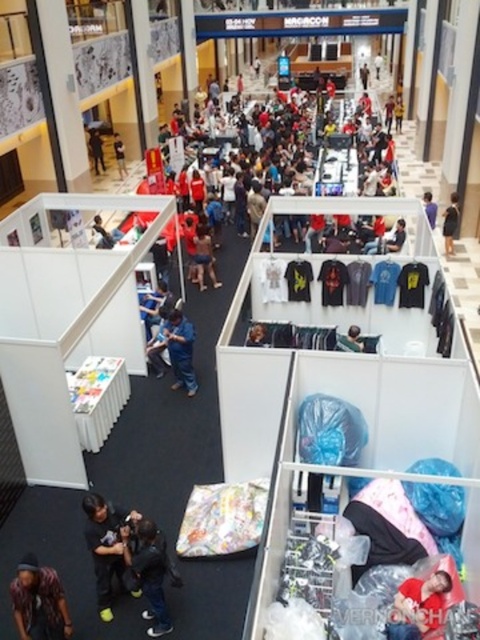
Is multicolored hair at lower left behind matte blue shirt at center?

No, multicolored hair at lower left is in front of matte blue shirt at center.

Does point (21, 588) come farther from viewer compared to point (116, 157)?

No.

You are a GUI agent. You are given a task and a screenshot of the screen. Output one action in this format:
    pyautogui.click(x=<x>, y=<y>)
    Task: Click on the multicolored hair at lower left
    The height and width of the screenshot is (640, 480).
    Given the screenshot: What is the action you would take?
    coord(38,602)

Is point (186, 387) positioned in front of point (457, 202)?

Yes.

Image resolution: width=480 pixels, height=640 pixels. Find the location of `blue jeans at center`. blue jeans at center is located at coordinates coord(180,349).

Who is more forward, (178, 330) or (455, 218)?

Point (178, 330)

You are a GUI agent. You are given a task and a screenshot of the screen. Output one action in this format:
    pyautogui.click(x=<x>, y=<y>)
    Task: Click on the blue jeans at center
    Image resolution: width=480 pixels, height=640 pixels.
    Given the screenshot: What is the action you would take?
    pyautogui.click(x=180, y=349)

Between point (453, 237) and point (120, 161), which one is positioned in front?

Point (453, 237) is in front.

Which of these two, black fabric shirt at center or matte blue shirt at center, stands shorter?

Standing shorter between the two is matte blue shirt at center.

The height and width of the screenshot is (640, 480). What do you see at coordinates (450, 224) in the screenshot?
I see `black fabric shirt at center` at bounding box center [450, 224].

At what (x,y) coordinates should I click in order to perform the action: click on black fabric shirt at center. Please return your answer as a coordinate pair (x, y). This screenshot has width=480, height=640. Looking at the image, I should click on (450, 224).